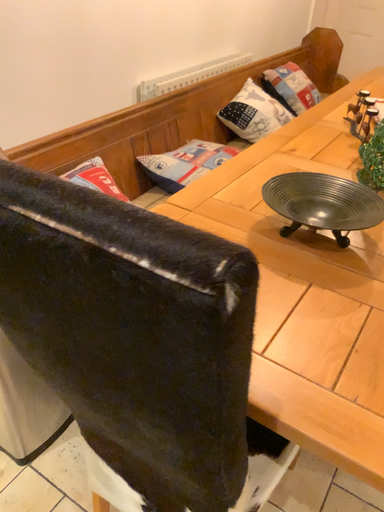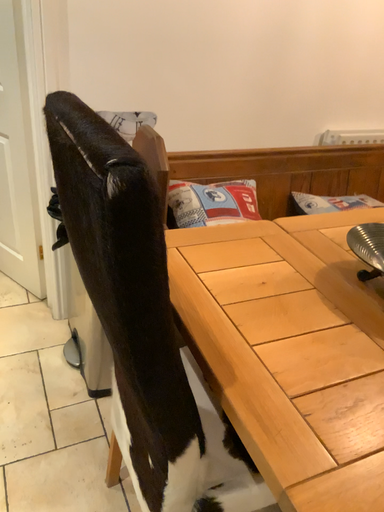
Question: Which way did the camera rotate in the video?

Choices:
 (A) rotated left
 (B) rotated right

Answer: (A)